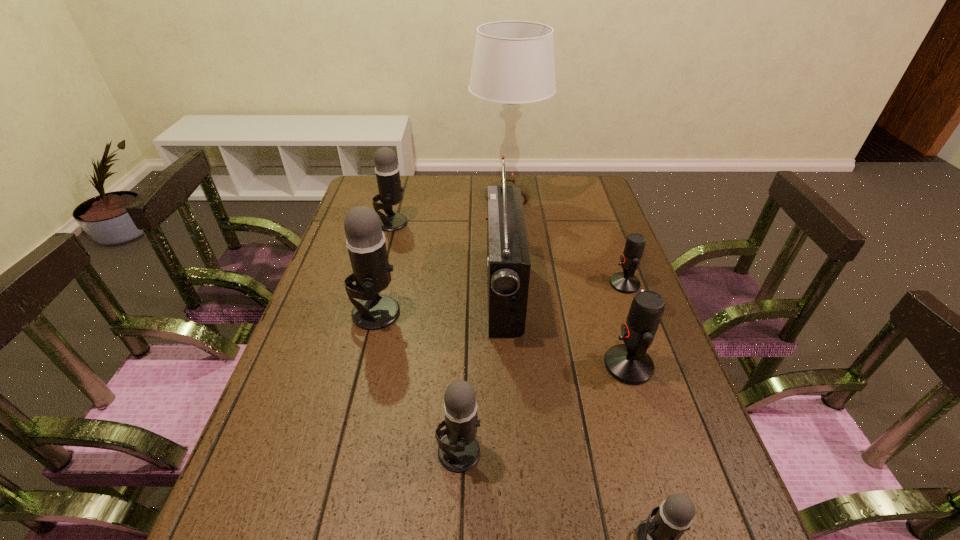
The image size is (960, 540). Find the location of `free region located on the side of the sixth farthest object with the red ring`. free region located on the side of the sixth farthest object with the red ring is located at coordinates (558, 365).

Where is `vacant space situated 0.270m on the side of the sixth farthest object with the red ring`? The image size is (960, 540). vacant space situated 0.270m on the side of the sixth farthest object with the red ring is located at coordinates (491, 365).

The width and height of the screenshot is (960, 540). Identify the location of vacant space located on the side of the sixth farthest object with the red ring. (516, 365).

The height and width of the screenshot is (540, 960). I want to click on free space located 0.360m on the left of the seventh farthest object, so click(258, 451).

This screenshot has height=540, width=960. I want to click on vacant space located on the side of the farther red microphone with the red ring, so click(x=477, y=284).

Where is `free region located 0.310m on the side of the farther red microphone with the red ring`? free region located 0.310m on the side of the farther red microphone with the red ring is located at coordinates (502, 284).

At what (x,y) coordinates should I click in order to perform the action: click on vacant space situated 0.270m on the side of the farther red microphone with the red ring. Please return your answer as a coordinate pair (x, y). This screenshot has width=960, height=540. Looking at the image, I should click on (516, 284).

In order to click on object that is at the far edge in this screenshot , I will do `click(513, 63)`.

In the image, there is a desktop. Identify the location of vacant space at the far edge. Image resolution: width=960 pixels, height=540 pixels. (525, 181).

Identify the location of vacant space at the left edge of the desktop. The width and height of the screenshot is (960, 540). (296, 369).